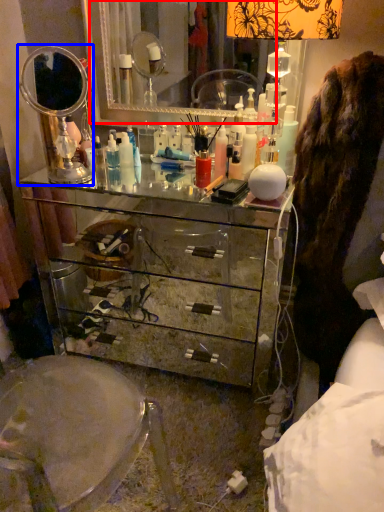
Question: Which of the following is the closest to the observer, mirror (highlighted by a red box) or mirror (highlighted by a blue box)?

Choices:
 (A) mirror
 (B) mirror

Answer: (B)